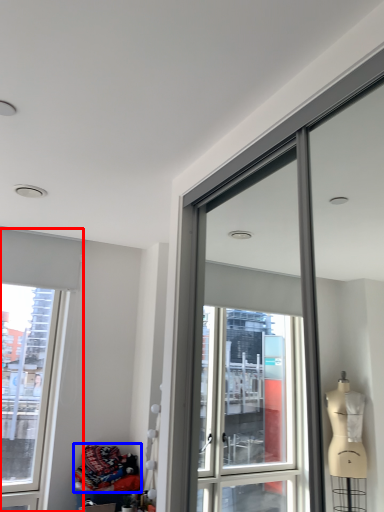
Question: Which object is further to the camera taking this photo, window (highlighted by a red box) or material (highlighted by a blue box)?

Choices:
 (A) window
 (B) material

Answer: (A)